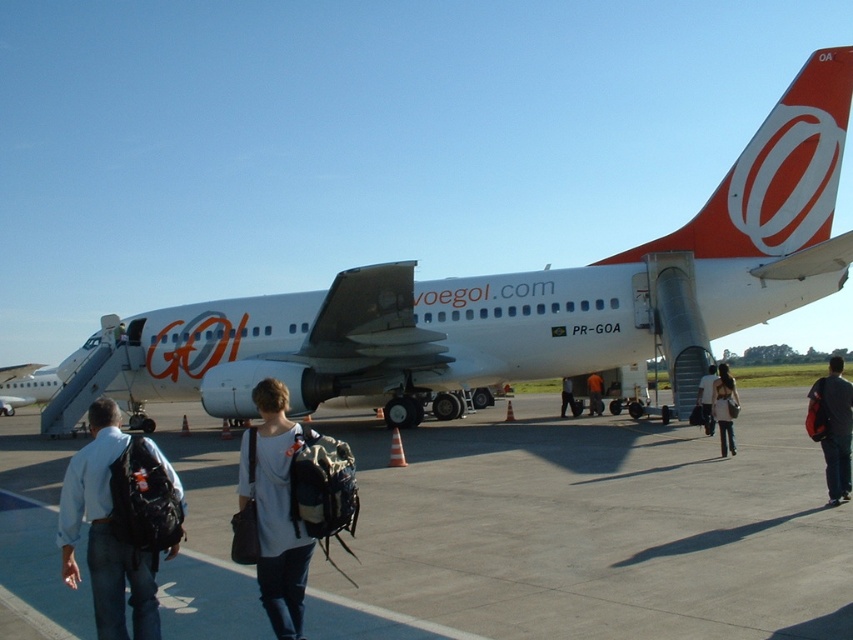
Question: Can you confirm if white matte airliner at center is thinner than dark gray backpack at center?

Choices:
 (A) yes
 (B) no

Answer: (A)

Question: Among these points, which one is nearest to the camera?

Choices:
 (A) click(123, 614)
 (B) click(299, 429)

Answer: (A)

Question: Does orange matte airplane tail at upper right have a lesser width compared to denim jacket at center?

Choices:
 (A) no
 (B) yes

Answer: (A)

Question: Is white fabric shirt at center to the right of denim jacket at center from the viewer's perspective?

Choices:
 (A) no
 (B) yes

Answer: (A)

Question: Which point is farther from the camera taking this photo?

Choices:
 (A) (270, 326)
 (B) (573, 408)

Answer: (B)

Question: Which point is farther to the camera?

Choices:
 (A) (573, 400)
 (B) (68, 502)
 (C) (824, 452)
 (D) (700, 388)

Answer: (A)